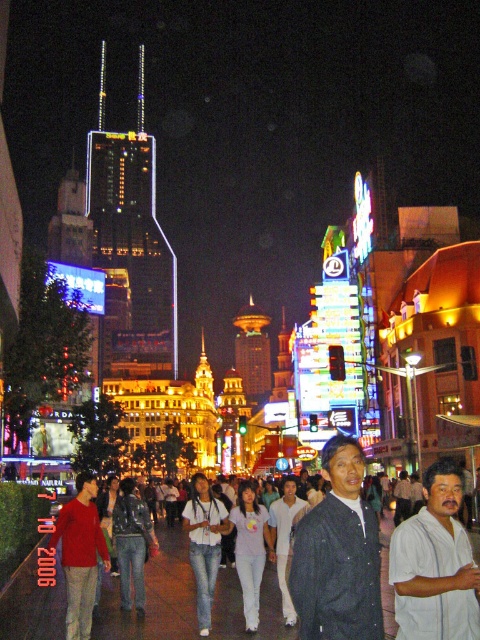
Question: Where is dark blue denim shirt at center located in relation to white cotton shirt at lower right in the image?

Choices:
 (A) right
 (B) left

Answer: (B)

Question: Based on their relative distances, which object is farther from the smooth concrete pavement at center?

Choices:
 (A) matte red sweater at center
 (B) dark blue denim shirt at center
 (C) white cotton shirt at lower right

Answer: (C)

Question: Which object appears closest to the camera in this image?

Choices:
 (A) smooth concrete pavement at center
 (B) white cotton shirt at lower right
 (C) matte red sweater at center

Answer: (B)

Question: Which point appears farthest from the camera in this image?

Choices:
 (A) (328, 538)
 (B) (238, 611)

Answer: (B)

Question: Observing the image, what is the correct spatial positioning of smooth concrete pavement at center in reference to dark blue denim shirt at center?

Choices:
 (A) below
 (B) above

Answer: (A)

Question: In this image, where is smooth concrete pavement at center located relative to white cotton shirt at lower right?

Choices:
 (A) above
 (B) below

Answer: (B)